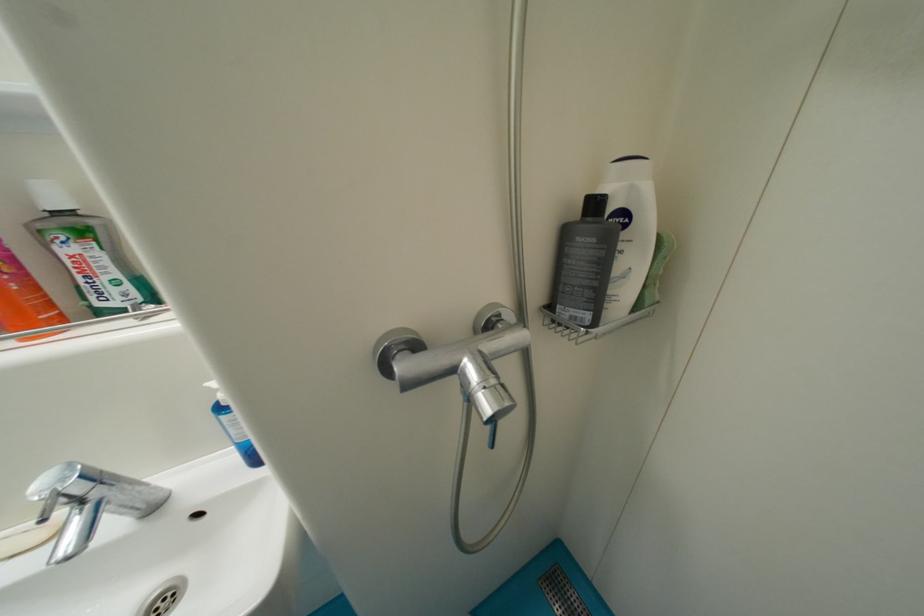
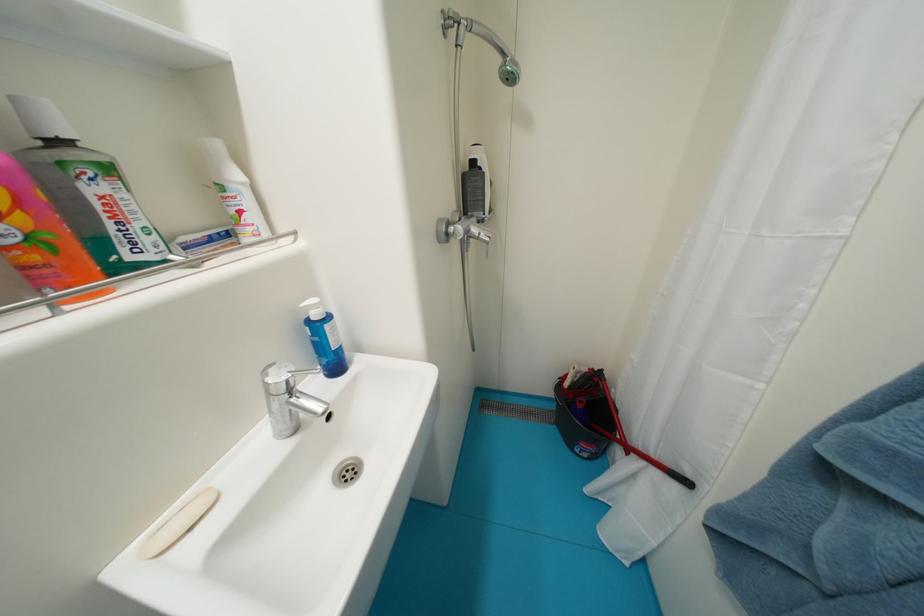
Question: The camera is either moving clockwise (left) or counter-clockwise (right) around the object. The first image is from the beginning of the video and the second image is from the end. Is the camera moving left or right when shooting the video?

Choices:
 (A) Left
 (B) Right

Answer: (A)